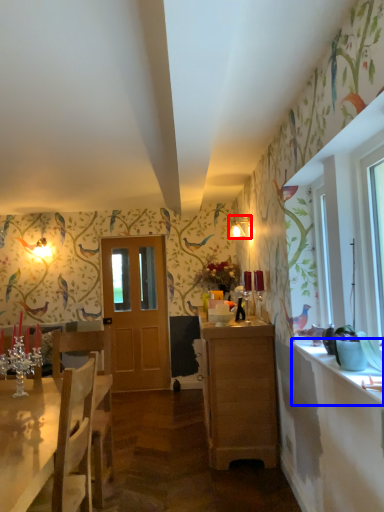
Question: Which of the following is the closest to the observer, lamp (highlighted by a red box) or counter top (highlighted by a blue box)?

Choices:
 (A) lamp
 (B) counter top

Answer: (B)